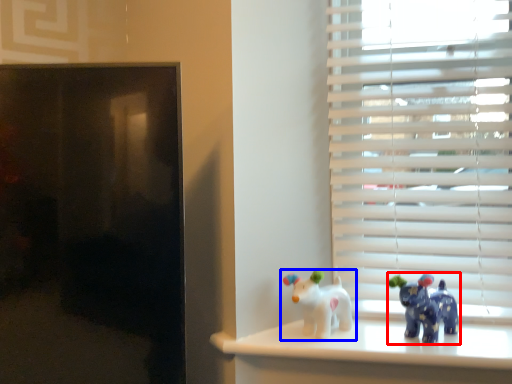
Question: Which object appears farthest to the camera in this image, toy (highlighted by a red box) or toy (highlighted by a blue box)?

Choices:
 (A) toy
 (B) toy

Answer: (B)